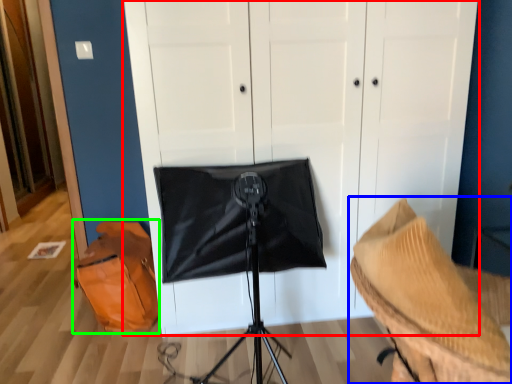
Question: Which is farther away from dresser (highlighted by a red box)? furniture (highlighted by a blue box) or messenger bag (highlighted by a green box)?

Choices:
 (A) furniture
 (B) messenger bag

Answer: (A)